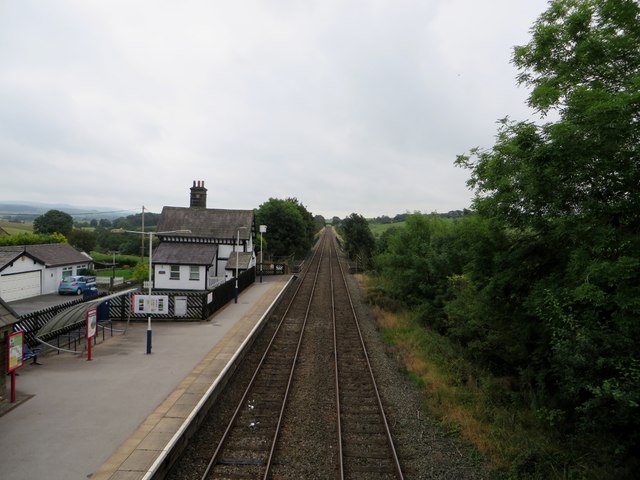
The width and height of the screenshot is (640, 480). Find the location of `chimney`. chimney is located at coordinates (193, 198).